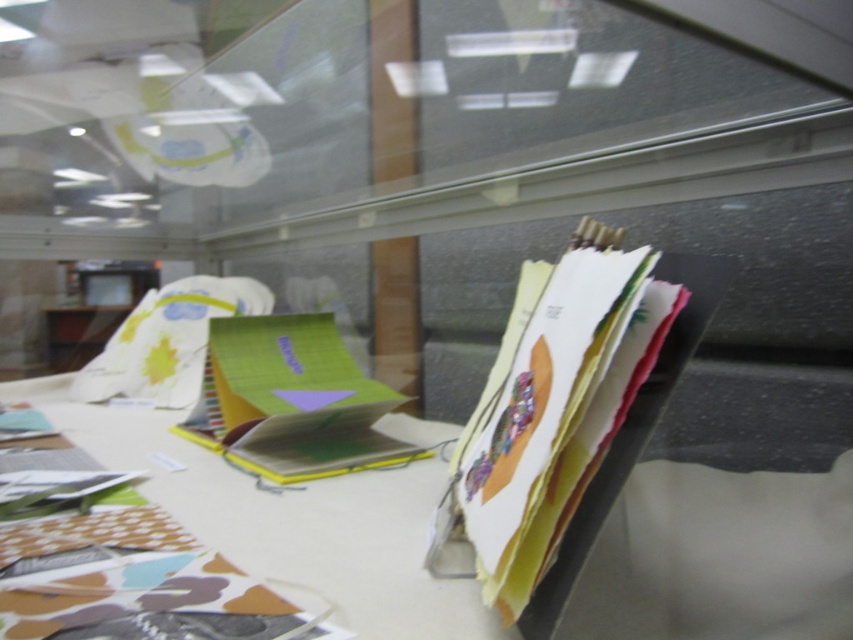
Does matte paper table at center come in front of matte paper stack at right?

No, matte paper table at center is further to the viewer.

Image resolution: width=853 pixels, height=640 pixels. What do you see at coordinates (289, 522) in the screenshot? I see `matte paper table at center` at bounding box center [289, 522].

What are the coordinates of `matte paper table at center` in the screenshot? It's located at (289, 522).